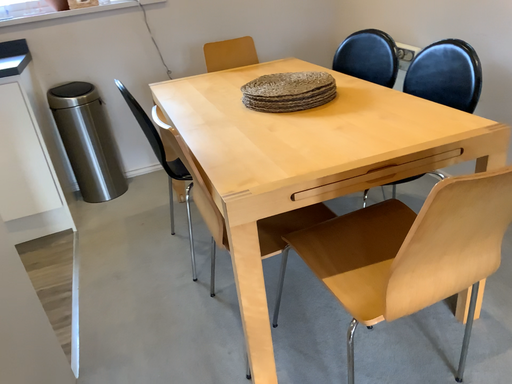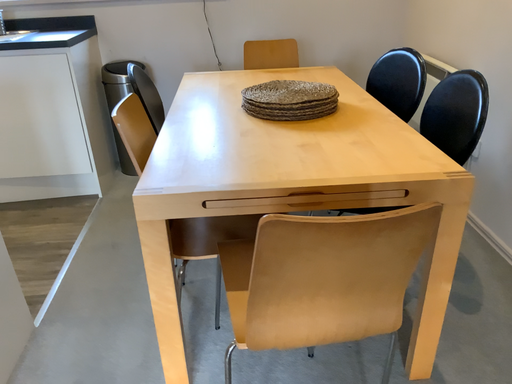
Question: Which way did the camera rotate in the video?

Choices:
 (A) rotated right
 (B) rotated left

Answer: (B)